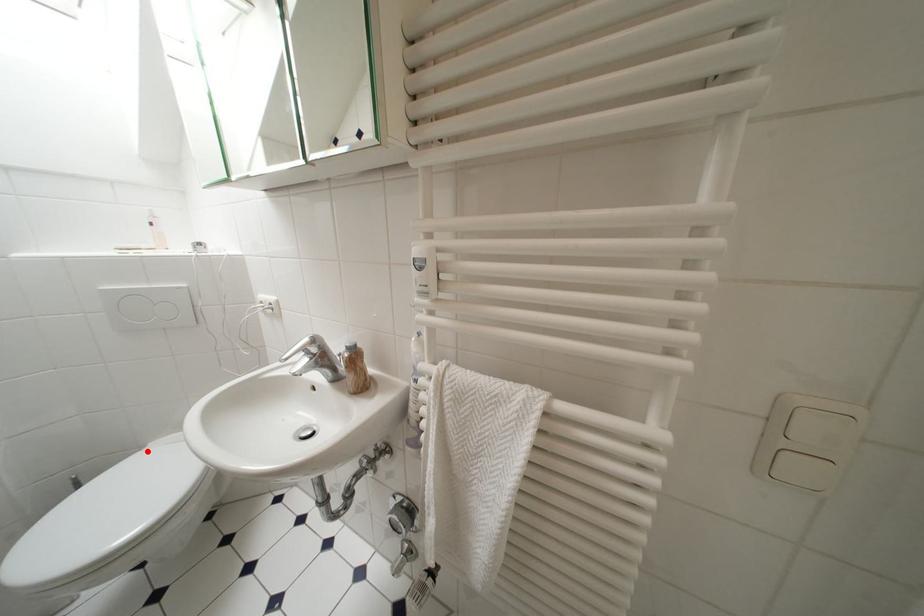
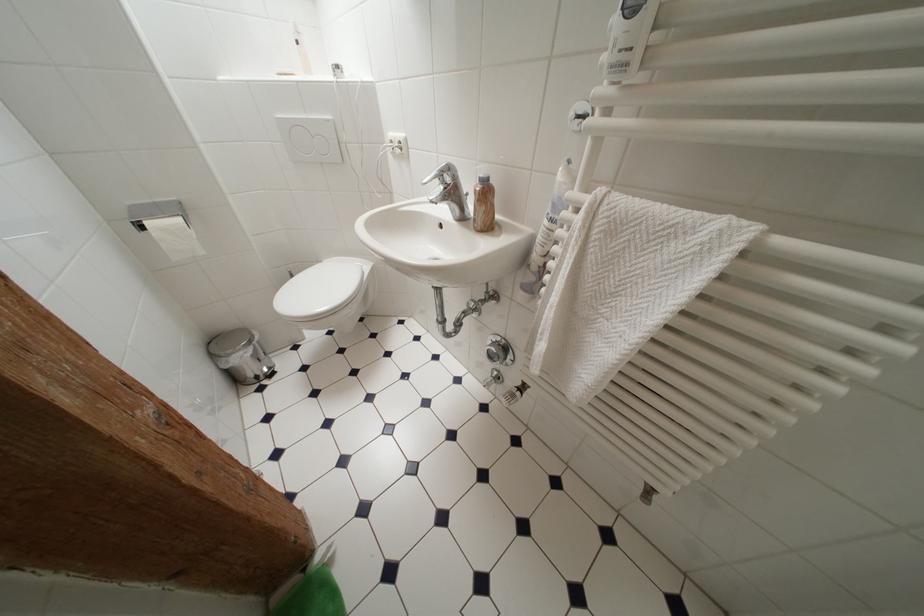
In the second image, find the point that corresponds to the highlighted location in the first image.

(325, 265)